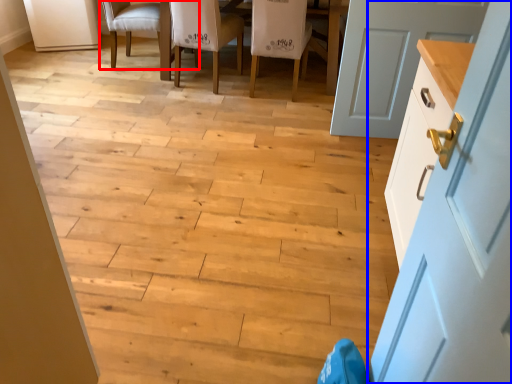
Question: Which object is further to the camera taking this photo, chair (highlighted by a red box) or door (highlighted by a blue box)?

Choices:
 (A) chair
 (B) door

Answer: (A)